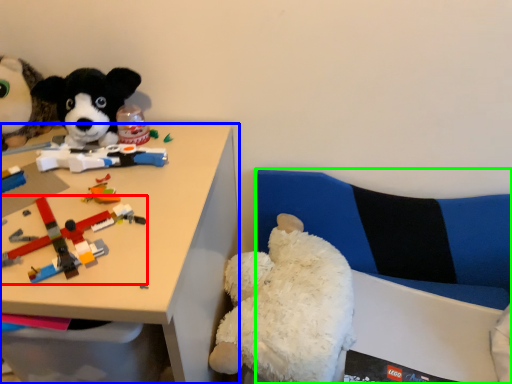
Question: Estimate the real-world distances between objects in this image. Which object is closer to toy (highlighted by a red box), desk (highlighted by a blue box) or couch (highlighted by a green box)?

Choices:
 (A) desk
 (B) couch

Answer: (A)